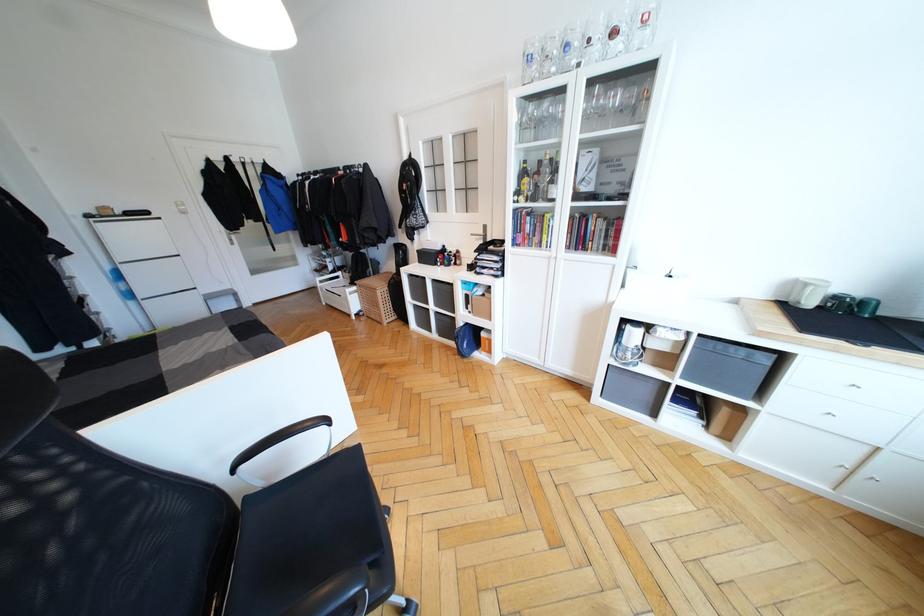
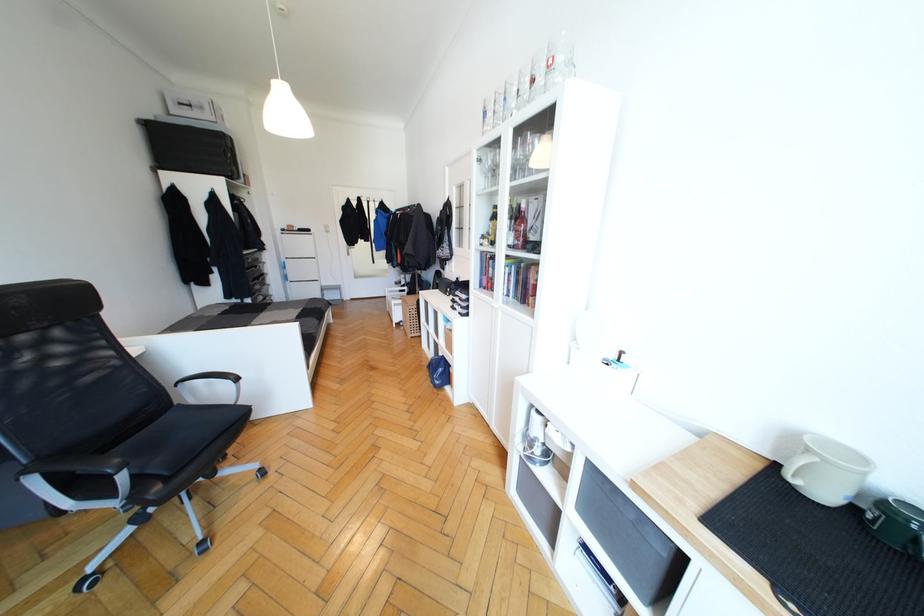
The point at (330, 422) is marked in the first image. Where is the corresponding point in the second image?

(239, 379)